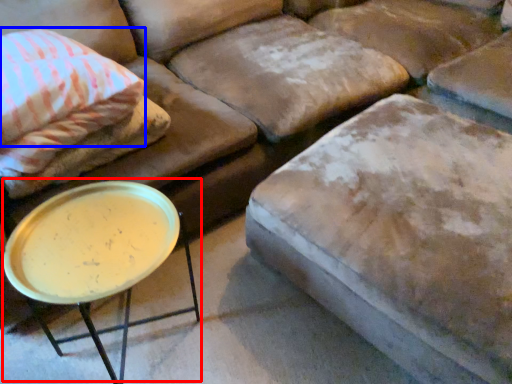
Question: Among these objects, which one is farthest to the camera, round table (highlighted by a red box) or pillow (highlighted by a blue box)?

Choices:
 (A) round table
 (B) pillow

Answer: (B)